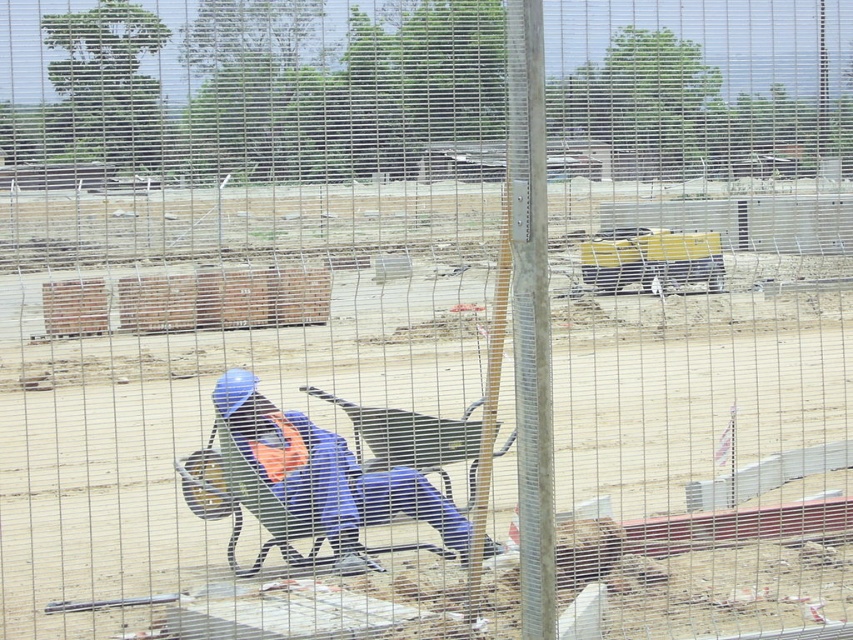
You are a safety inspector observing the construction site through the fence. You notice the blue hard hat at center and the orange fabric safety vest at center. Which object is wider?

The blue hard hat at center is wider than the orange fabric safety vest at center.

You are a safety inspector at the construction site. You notice the blue hard hat at center and the orange fabric safety vest at center. Which one is bigger in size?

The blue hard hat at center has a larger size compared to the orange fabric safety vest at center.

You are a safety inspector at the construction site. You notice the blue hard hat at center and the orange fabric safety vest at center. Which one is positioned to the right side of the other?

The blue hard hat at center is to the right of orange fabric safety vest at center.